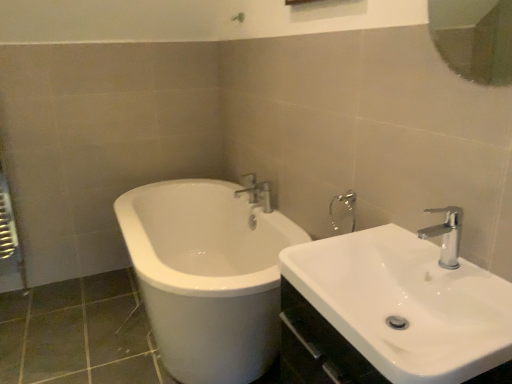
The image size is (512, 384). Find the location of `free spot in front of chrome metallic faucet at upper right, the second tap when ordered from left to right`. free spot in front of chrome metallic faucet at upper right, the second tap when ordered from left to right is located at coordinates (465, 308).